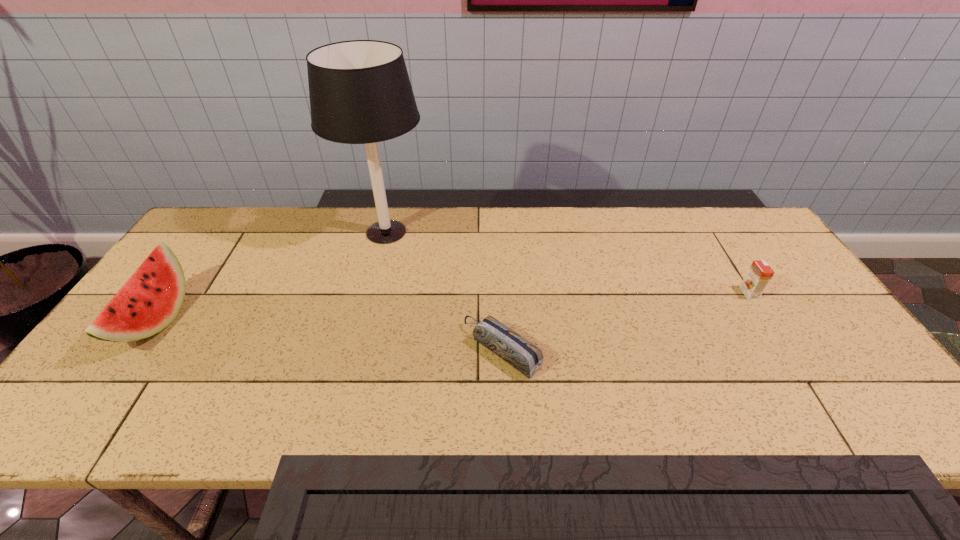
At what (x,y) coordinates should I click in order to perform the action: click on vacant area between the tallest object and the watermelon. Please return your answer as a coordinate pair (x, y). Looking at the image, I should click on (272, 276).

Find the location of a particular element. The image size is (960, 540). object that is the second closest one to the leftmost object is located at coordinates (520, 353).

Locate an element on the screen. The width and height of the screenshot is (960, 540). object identified as the third closest to the farthest object is located at coordinates (759, 274).

Where is `vacant space that satisfies the following two spatial constraints: 1. on the back side of the pencil box; 2. on the outer rind of the leftmost object`? The width and height of the screenshot is (960, 540). vacant space that satisfies the following two spatial constraints: 1. on the back side of the pencil box; 2. on the outer rind of the leftmost object is located at coordinates (501, 321).

This screenshot has width=960, height=540. In order to click on free location that satisfies the following two spatial constraints: 1. on the front side of the tallest object; 2. on the left side of the orange juice in this screenshot , I will do `click(371, 293)`.

The height and width of the screenshot is (540, 960). I want to click on vacant space that satisfies the following two spatial constraints: 1. on the front side of the table lamp; 2. on the outer rind of the leftmost object, so 364,321.

Locate an element on the screen. The height and width of the screenshot is (540, 960). free point that satisfies the following two spatial constraints: 1. on the outer rind of the watermelon; 2. on the back side of the pencil box is located at coordinates (136, 350).